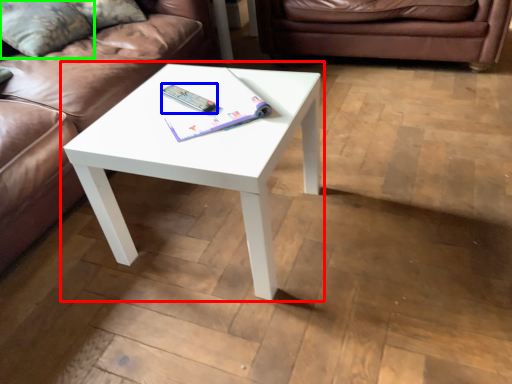
Question: Based on their relative distances, which object is farther from coffee table (highlighted by a red box)? Choose from remote (highlighted by a blue box) and pillow (highlighted by a green box).

Choices:
 (A) remote
 (B) pillow

Answer: (B)